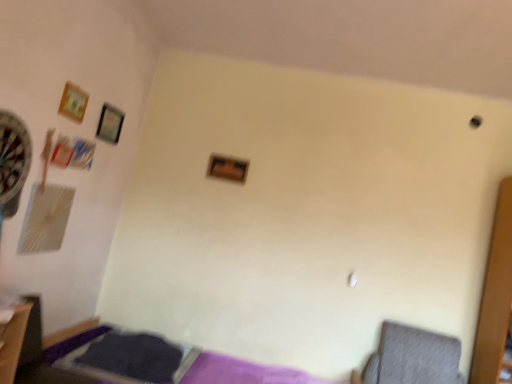
Question: Is wooden frame at center, marked as the 1th picture frame in a right-to-left arrangement, touching gray fabric swivel chair at lower right?

Choices:
 (A) yes
 (B) no

Answer: (B)

Question: Considering the relative sizes of wooden frame at center, the third picture frame from the left, and gray fabric swivel chair at lower right in the image provided, is wooden frame at center, the third picture frame from the left, bigger than gray fabric swivel chair at lower right?

Choices:
 (A) yes
 (B) no

Answer: (B)

Question: Is the depth of wooden frame at center, the first picture frame when ordered from back to front, less than that of gray fabric swivel chair at lower right?

Choices:
 (A) no
 (B) yes

Answer: (A)

Question: From a real-world perspective, is wooden frame at center, positioned as the third picture frame in front-to-back order, on top of gray fabric swivel chair at lower right?

Choices:
 (A) no
 (B) yes

Answer: (B)

Question: Is there a large distance between wooden frame at center, the third picture frame from the left, and gray fabric swivel chair at lower right?

Choices:
 (A) yes
 (B) no

Answer: (A)

Question: From the image's perspective, is wooden frame at center, marked as the 1th picture frame in a right-to-left arrangement, over gray fabric swivel chair at lower right?

Choices:
 (A) no
 (B) yes

Answer: (B)

Question: From a real-world perspective, is wooden frame at upper left, acting as the 3th picture frame starting from the right, beneath gray fabric swivel chair at lower right?

Choices:
 (A) no
 (B) yes

Answer: (A)

Question: Is wooden frame at upper left, acting as the 3th picture frame starting from the right, bigger than gray fabric swivel chair at lower right?

Choices:
 (A) no
 (B) yes

Answer: (A)

Question: From the image's perspective, does wooden frame at upper left, the first picture frame positioned from the left, appear higher than gray fabric swivel chair at lower right?

Choices:
 (A) no
 (B) yes

Answer: (B)

Question: Is wooden frame at upper left, acting as the 3th picture frame starting from the right, outside gray fabric swivel chair at lower right?

Choices:
 (A) yes
 (B) no

Answer: (A)

Question: Is wooden frame at upper left, the first picture frame positioned from the left, positioned in front of gray fabric swivel chair at lower right?

Choices:
 (A) no
 (B) yes

Answer: (A)

Question: From the image's perspective, is wooden frame at upper left, the 3th picture frame in the back-to-front sequence, located beneath gray fabric swivel chair at lower right?

Choices:
 (A) no
 (B) yes

Answer: (A)

Question: From the image's perspective, is gray fabric swivel chair at lower right beneath wooden frame at center, the third picture frame from the left?

Choices:
 (A) yes
 (B) no

Answer: (A)